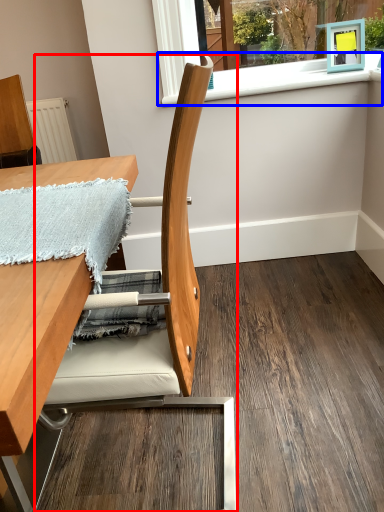
Question: Among these objects, which one is nearest to the camera, chair (highlighted by a red box) or window sill (highlighted by a blue box)?

Choices:
 (A) chair
 (B) window sill

Answer: (A)